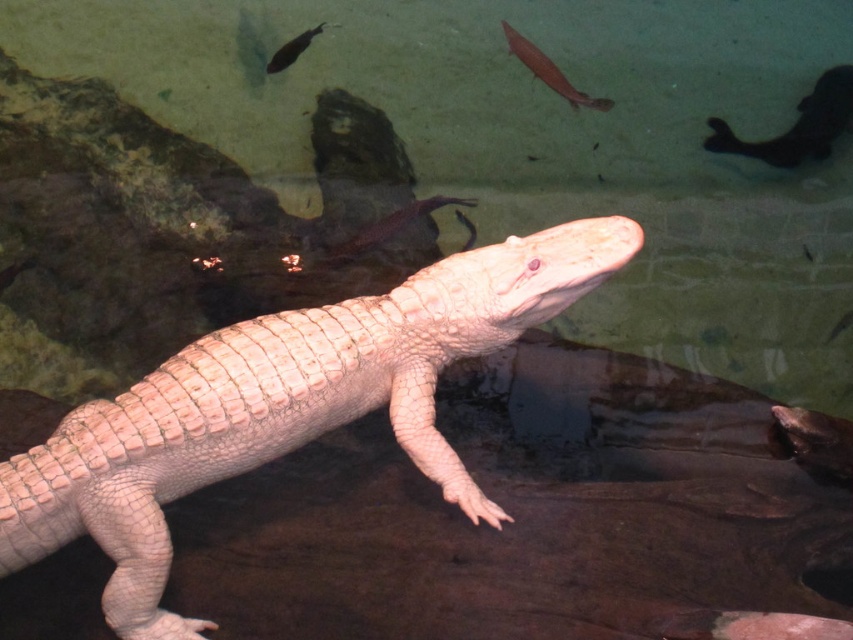
Question: Estimate the real-world distances between objects in this image. Which object is farther from the translucent glass at center?

Choices:
 (A) shiny black fish at upper left
 (B) shiny silver fish at upper center
 (C) silvery metallic fish at upper right

Answer: (C)

Question: Can you confirm if shiny silver fish at upper center is thinner than translucent glass at center?

Choices:
 (A) yes
 (B) no

Answer: (A)

Question: From the image, what is the correct spatial relationship of silvery metallic fish at upper right in relation to shiny silver fish at upper center?

Choices:
 (A) left
 (B) right

Answer: (B)

Question: Which point is farther from the camera taking this photo?

Choices:
 (A) (601, 100)
 (B) (277, 58)
 (C) (424, 280)

Answer: (B)

Question: Can you confirm if silvery metallic fish at upper right is positioned to the left of shiny black fish at upper left?

Choices:
 (A) yes
 (B) no

Answer: (B)

Question: Which point is closer to the camera?

Choices:
 (A) (717, 138)
 (B) (584, 104)

Answer: (B)